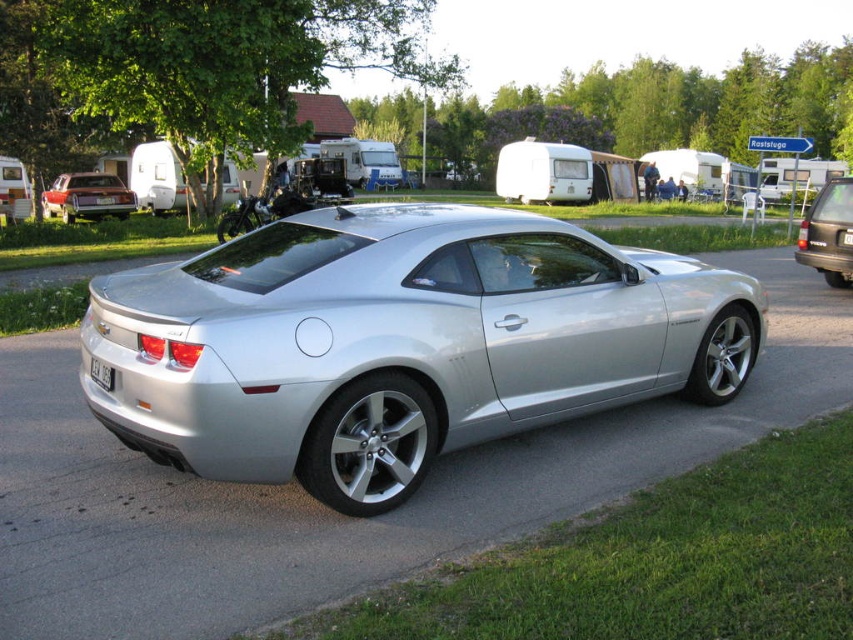
Question: Is silver metallic sports car at center thinner than satin black suv at right?

Choices:
 (A) no
 (B) yes

Answer: (A)

Question: Which object is farther from the camera taking this photo?

Choices:
 (A) white plastic license plate at rear
 (B) metallic red sedan at lower left
 (C) black plastic license plate at rear

Answer: (B)

Question: Is satin black suv at right below black plastic license plate at rear?

Choices:
 (A) no
 (B) yes

Answer: (A)

Question: Which is farther from the metallic red sedan at lower left?

Choices:
 (A) silver metallic sports car at center
 (B) black plastic license plate at center
 (C) satin black suv at right
 (D) black plastic license plate at rear

Answer: (A)

Question: Which object appears closest to the camera in this image?

Choices:
 (A) black plastic license plate at center
 (B) metallic red sedan at lower left

Answer: (B)

Question: Observing the image, what is the correct spatial positioning of silver metallic sports car at center in reference to black plastic license plate at center?

Choices:
 (A) right
 (B) left

Answer: (A)